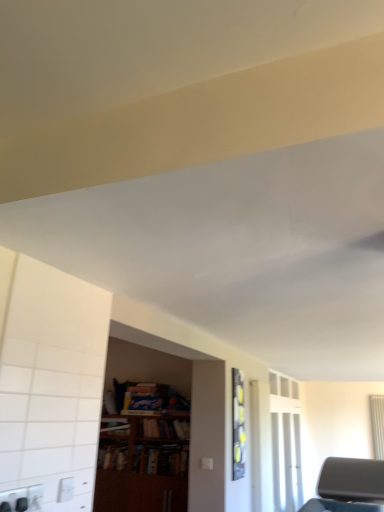
In order to face transparent glass door at right, should I rotate leftwards or rightwards?

Turn right by 12.767 degrees to look at transparent glass door at right.

Image resolution: width=384 pixels, height=512 pixels. What do you see at coordinates (286, 461) in the screenshot? I see `transparent glass door at right` at bounding box center [286, 461].

What is the approximate width of white plastic electric outlet at lower left?

The width of white plastic electric outlet at lower left is 0.82 inches.

This screenshot has height=512, width=384. What do you see at coordinates (65, 489) in the screenshot?
I see `white plastic electric outlet at lower left` at bounding box center [65, 489].

This screenshot has width=384, height=512. Describe the element at coordinates (145, 458) in the screenshot. I see `wooden bookcase at center` at that location.

You are a GUI agent. You are given a task and a screenshot of the screen. Output one action in this format:
    pyautogui.click(x=<x>, y=<y>)
    Task: Click on the transparent glass door at right
    
    Given the screenshot: What is the action you would take?
    pyautogui.click(x=286, y=461)

Is transparent glass door at right further to camera compared to wooden bookshelf at center?

Yes.

What's the angular difference between transparent glass door at right and wooden bookshelf at center's facing directions?

The facing directions of transparent glass door at right and wooden bookshelf at center are 89.9 degrees apart.

Visually, is transparent glass door at right positioned to the left or to the right of wooden bookshelf at center?

Clearly, transparent glass door at right is on the right of wooden bookshelf at center in the image.

From the image's perspective, is transparent glass door at right on top of wooden bookshelf at center?

Incorrect, from the image's perspective, transparent glass door at right is lower than wooden bookshelf at center.

The width and height of the screenshot is (384, 512). What are the coordinates of `bookcase below the transparent glass door at right (from a real-world perspective)` in the screenshot? It's located at (145, 458).

In the scene shown: Which is behind, wooden bookcase at center or transparent glass door at right?

transparent glass door at right.

Choose the correct answer: Is wooden bookcase at center inside transparent glass door at right or outside it?

wooden bookcase at center is not inside transparent glass door at right, it's outside.

Does point (165, 469) appear closer or farther from the camera than point (295, 443)?

Clearly, point (165, 469) is closer to the camera than point (295, 443).

Could you tell me if wooden bookshelf at center is facing wooden bookcase at center?

Yes, wooden bookshelf at center is turned towards wooden bookcase at center.

Choose the correct answer: Is wooden bookshelf at center inside wooden bookcase at center or outside it?

wooden bookshelf at center is enclosed within wooden bookcase at center.

Based on the photo, which point is more forward, (x=152, y=431) or (x=174, y=487)?

The point (x=174, y=487) is closer to the camera.

Consider the image. From the image's perspective, is wooden bookshelf at center below wooden bookcase at center?

Incorrect, from the image's perspective, wooden bookshelf at center is higher than wooden bookcase at center.

Does wooden bookshelf at center turn towards transparent glass door at right?

No.

From a real-world perspective, relative to transparent glass door at right, is wooden bookshelf at center vertically above or below?

In terms of real-world spatial position, wooden bookshelf at center is above transparent glass door at right.

Would you say wooden bookshelf at center is to the left or to the right of transparent glass door at right in the picture?

Clearly, wooden bookshelf at center is on the left of transparent glass door at right in the image.

Considering the relative positions of wooden bookcase at center and white plastic electric outlet at lower left in the image provided, is wooden bookcase at center to the left of white plastic electric outlet at lower left from the viewer's perspective?

Yes.

Does wooden bookcase at center have a larger size compared to white plastic electric outlet at lower left?

Correct, wooden bookcase at center is larger in size than white plastic electric outlet at lower left.

Between wooden bookcase at center and white plastic electric outlet at lower left, which one is positioned behind?

wooden bookcase at center is further away from the camera.

Does wooden bookcase at center touch wooden bookshelf at center?

No, wooden bookcase at center is not beside wooden bookshelf at center.

The image size is (384, 512). Find the location of `bookcase on the left of wooden bookshelf at center`. bookcase on the left of wooden bookshelf at center is located at coordinates point(145,458).

From the image's perspective, is wooden bookcase at center under wooden bookshelf at center?

Indeed, from the image's perspective, wooden bookcase at center is shown beneath wooden bookshelf at center.

Is white plastic electric outlet at lower left positioned far away from wooden bookshelf at center?

Yes, white plastic electric outlet at lower left is far from wooden bookshelf at center.

Is white plastic electric outlet at lower left positioned before wooden bookshelf at center?

Yes, white plastic electric outlet at lower left is closer to the camera.

Can you confirm if white plastic electric outlet at lower left is wider than wooden bookshelf at center?

In fact, white plastic electric outlet at lower left might be narrower than wooden bookshelf at center.

Can you confirm if white plastic electric outlet at lower left is bigger than wooden bookshelf at center?

Incorrect, white plastic electric outlet at lower left is not larger than wooden bookshelf at center.

Image resolution: width=384 pixels, height=512 pixels. What are the coordinates of `glass door located below the wooden bookshelf at center (from the image's perspective)` in the screenshot? It's located at (286, 461).

Identify the location of bookcase lying in front of the transparent glass door at right. (145, 458).

Which object lies further to the anchor point wooden bookshelf at center, wooden bookcase at center or white plastic electric outlet at lower left?

white plastic electric outlet at lower left is positioned further to the anchor wooden bookshelf at center.

When comparing their distances from white plastic electric outlet at lower left, does transparent glass door at right or wooden bookshelf at center seem further?

transparent glass door at right is further to white plastic electric outlet at lower left.

Based on their spatial positions, is wooden bookshelf at center or white plastic electric outlet at lower left closer to wooden bookcase at center?

wooden bookshelf at center.

Considering their positions, is wooden bookcase at center positioned closer to transparent glass door at right than white plastic electric outlet at lower left?

wooden bookcase at center is positioned closer to the anchor transparent glass door at right.

Which object lies further to the anchor point white plastic electric outlet at lower left, wooden bookcase at center or wooden bookshelf at center?

The object further to white plastic electric outlet at lower left is wooden bookshelf at center.

From the image, which object appears to be nearer to transparent glass door at right, wooden bookshelf at center or white plastic electric outlet at lower left?

The object closer to transparent glass door at right is wooden bookshelf at center.

Looking at this image, which object lies further to the anchor point wooden bookshelf at center, white plastic electric outlet at lower left or transparent glass door at right?

Among the two, white plastic electric outlet at lower left is located further to wooden bookshelf at center.

Considering their positions, is wooden bookshelf at center positioned closer to white plastic electric outlet at lower left than wooden bookcase at center?

wooden bookcase at center lies closer to white plastic electric outlet at lower left than the other object.

Image resolution: width=384 pixels, height=512 pixels. Identify the location of bookcase between white plastic electric outlet at lower left and transparent glass door at right from front to back. (145, 458).

Find the location of `bookcase positioned between white plastic electric outlet at lower left and wooden bookshelf at center from near to far`. bookcase positioned between white plastic electric outlet at lower left and wooden bookshelf at center from near to far is located at coordinates (145, 458).

The image size is (384, 512). In order to click on book located between white plastic electric outlet at lower left and transparent glass door at right in the depth direction in this screenshot , I will do `click(166, 428)`.

The height and width of the screenshot is (512, 384). Find the location of `book between wooden bookcase at center and transparent glass door at right from left to right`. book between wooden bookcase at center and transparent glass door at right from left to right is located at coordinates (166, 428).